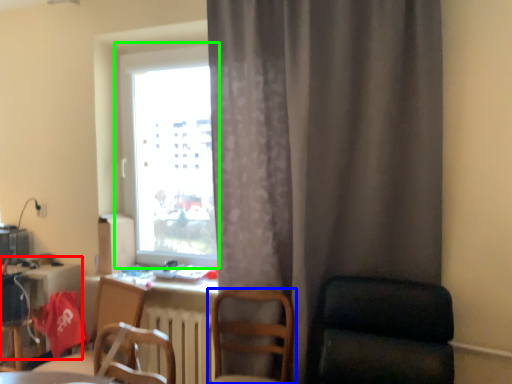
Question: Estimate the real-world distances between objects in this image. Which object is farther from computer desk (highlighted by a red box), chair (highlighted by a blue box) or window (highlighted by a green box)?

Choices:
 (A) chair
 (B) window

Answer: (A)